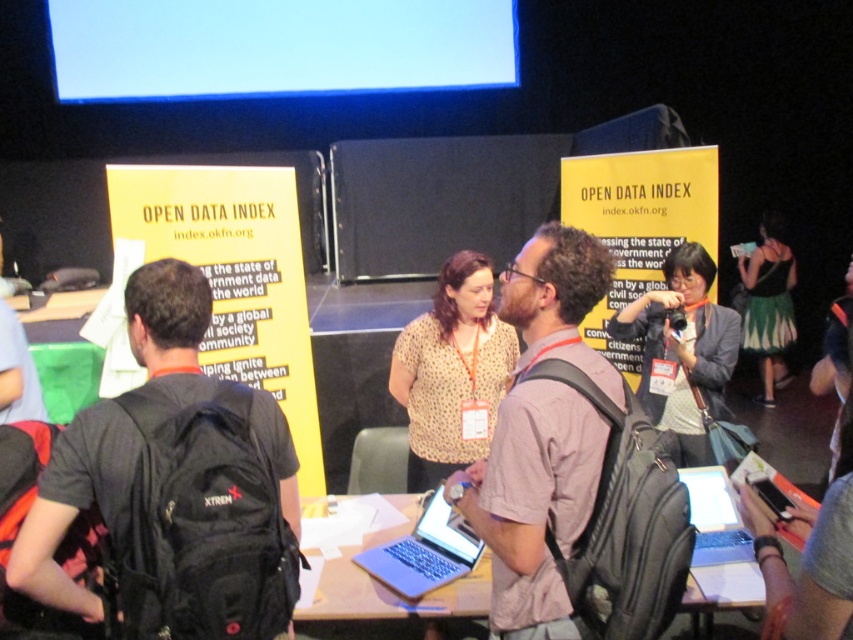
Question: Is black backpack at center thinner than green textured dress at right?

Choices:
 (A) yes
 (B) no

Answer: (B)

Question: Which is nearer to the black backpack at center?

Choices:
 (A) slate gray laptop at center
 (B) floral-patterned blouse at center
 (C) green textured dress at right
 (D) metallic silver laptop at center

Answer: (D)

Question: Is metallic silver laptop at center behind silver metallic laptop at center?

Choices:
 (A) no
 (B) yes

Answer: (A)

Question: Which of these objects is positioned closest to the black fabric camera at center?

Choices:
 (A) black backpack at center
 (B) metallic silver laptop at center
 (C) yellow paperboard at upper center
 (D) light brown fabric shirt at center

Answer: (C)

Question: Does black fabric camera at center lie behind green textured dress at right?

Choices:
 (A) no
 (B) yes

Answer: (A)

Question: Which of the following is the farthest from the observer?

Choices:
 (A) (432, 580)
 (B) (648, 289)
 (C) (762, 380)
 (D) (462, 580)

Answer: (C)